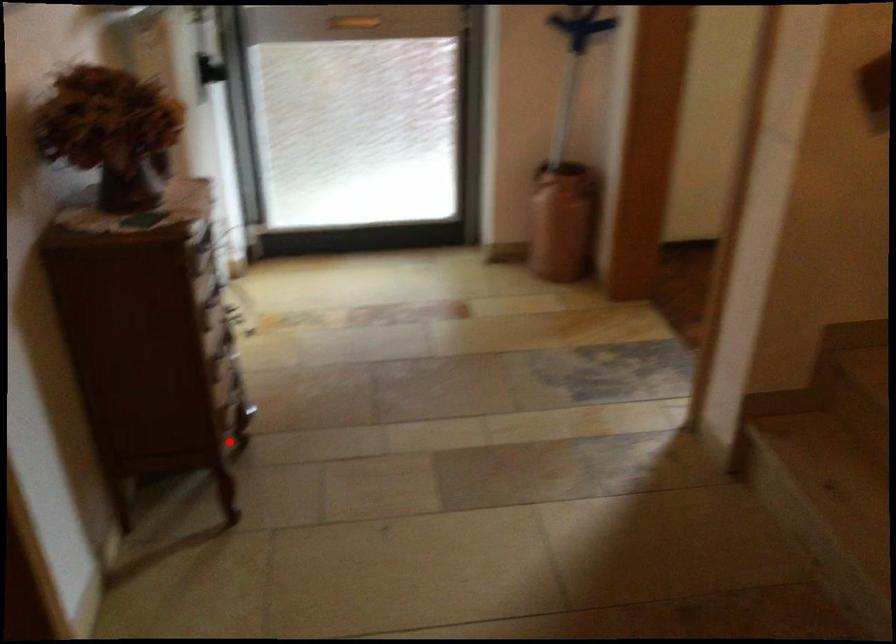
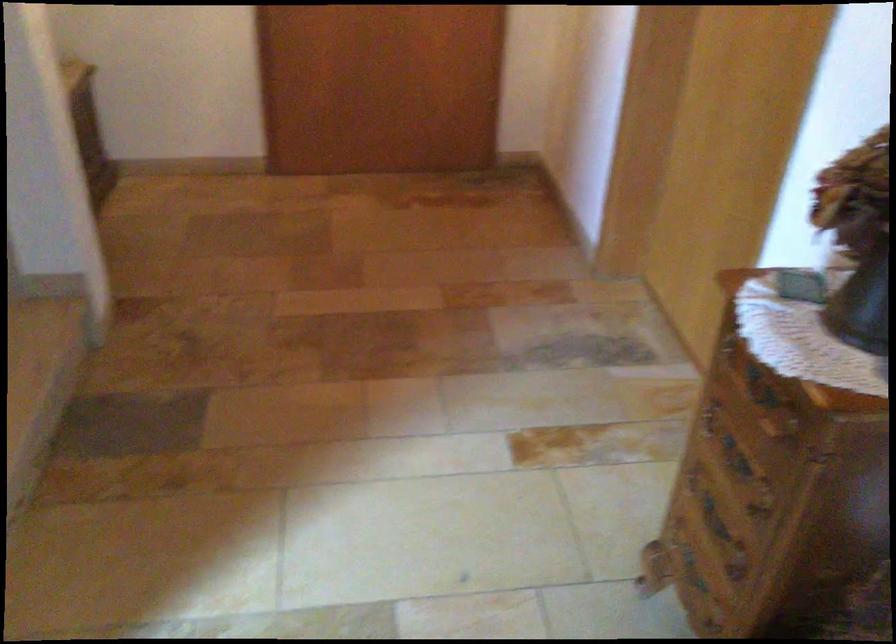
Question: I am providing you with two images of the same scene from different viewpoints. In image1, a red point is highlighted. Considering the same 3D point in image2, which of the following is correct?

Choices:
 (A) It is closer
 (B) It is farther

Answer: (A)